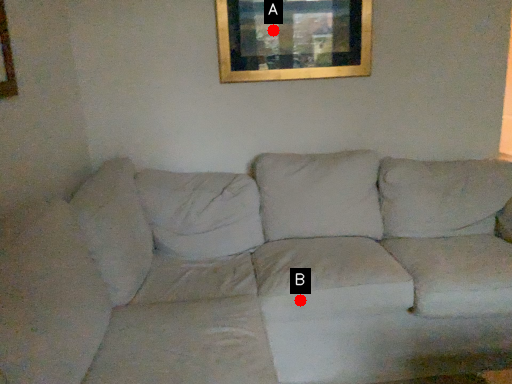
Question: Two points are circled on the image, labeled by A and B beside each circle. Which point is closer to the camera taking this photo?

Choices:
 (A) A is closer
 (B) B is closer

Answer: (B)